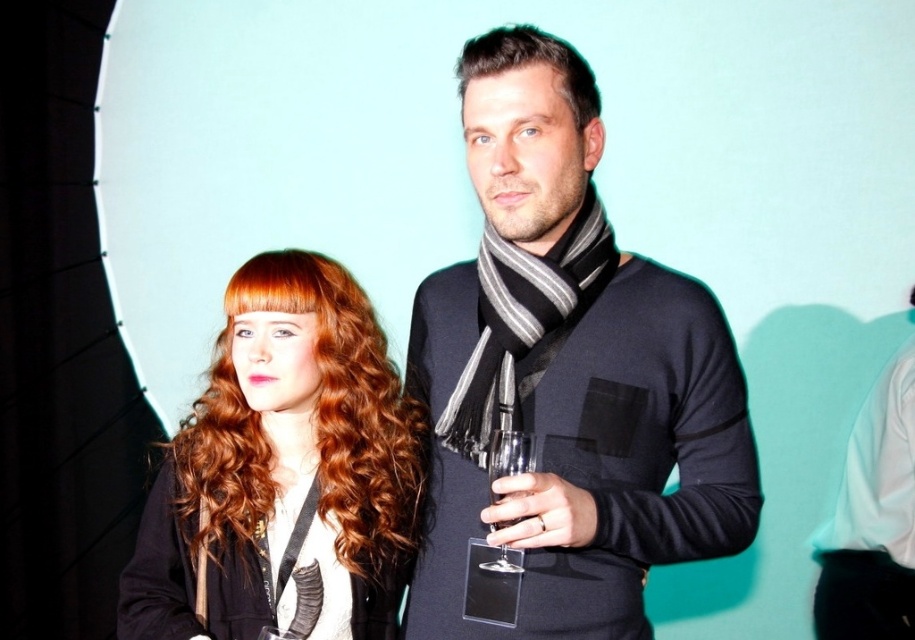
Does matte black scarf at center have a lesser width compared to matte black glass at center?

No, matte black scarf at center is not thinner than matte black glass at center.

Is point (459, 83) more distant than point (515, 536)?

Yes, point (459, 83) is behind point (515, 536).

In order to click on matte black scarf at center in this screenshot , I will do `click(568, 369)`.

I want to click on shiny red hair at center, so click(283, 467).

Who is more distant from viewer, (155, 509) or (521, 465)?

Point (155, 509)

The height and width of the screenshot is (640, 915). In order to click on shiny red hair at center in this screenshot , I will do `click(283, 467)`.

Does point (515, 538) come in front of point (536, 60)?

That is True.

Between matte black glass at center and dark brown hair at center, which one has less height?

matte black glass at center is shorter.

Does point (497, 508) lie in front of point (576, 104)?

Yes, point (497, 508) is in front of point (576, 104).

Identify the location of matte black glass at center. (540, 513).